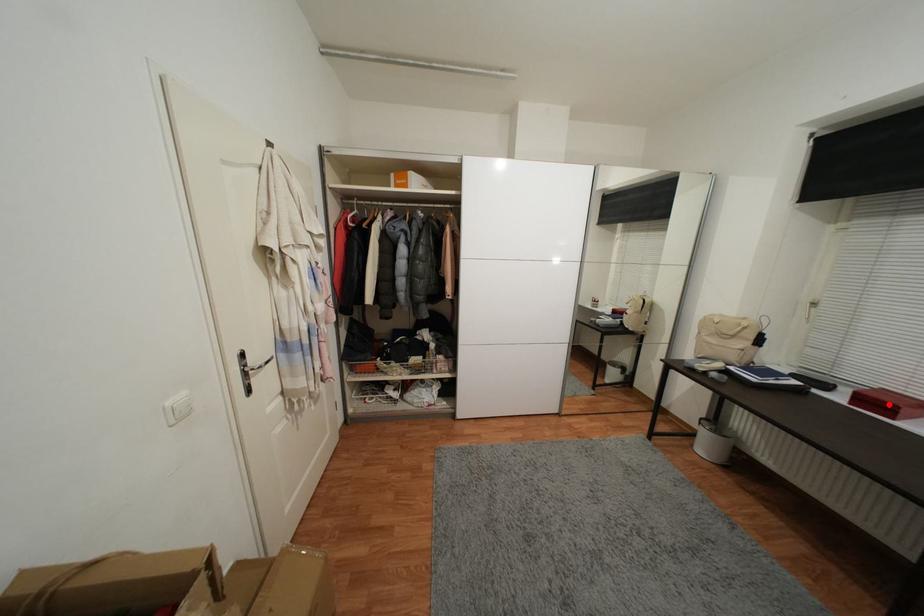
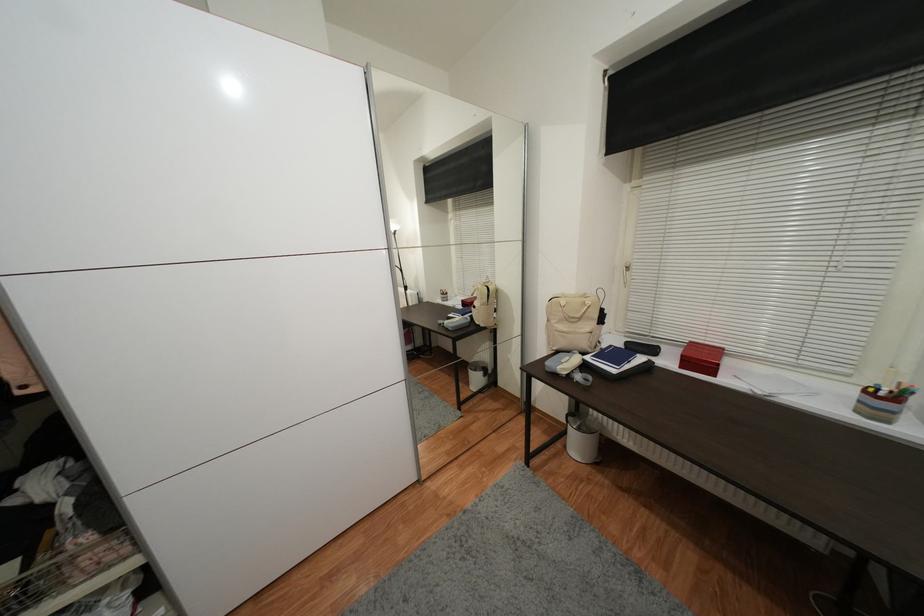
Find the pixel in the second image that matches the highlighted location in the first image.

(706, 361)